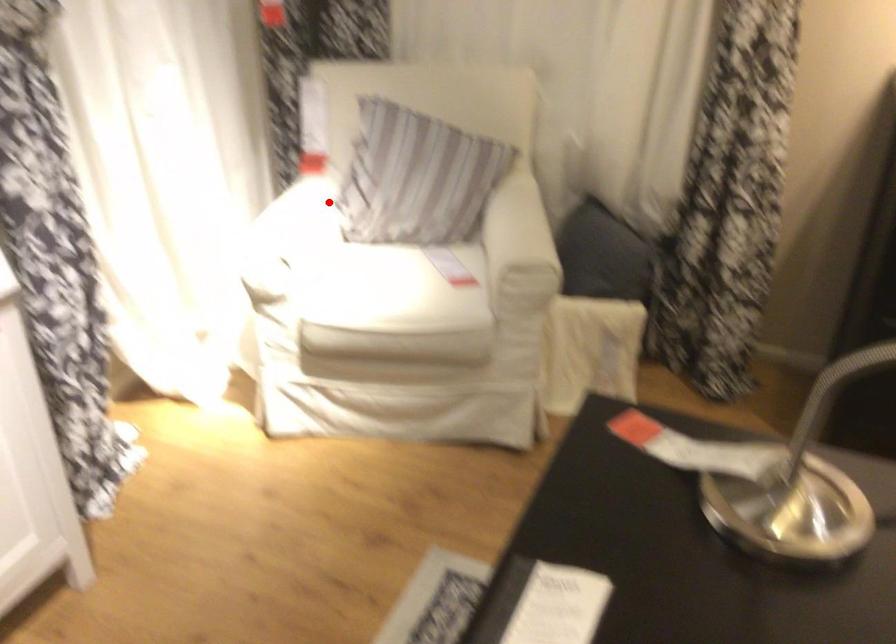
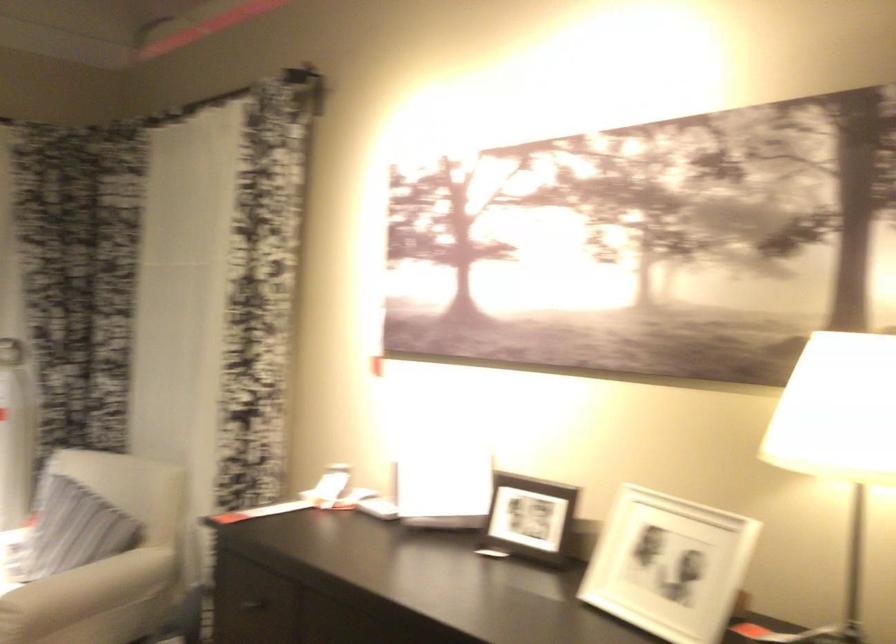
Question: I am providing you with two images of the same scene from different viewpoints. Given a red point in image1, look at the same physical point in image2. Is it:

Choices:
 (A) Closer to the viewpoint
 (B) Farther from the viewpoint

Answer: (B)